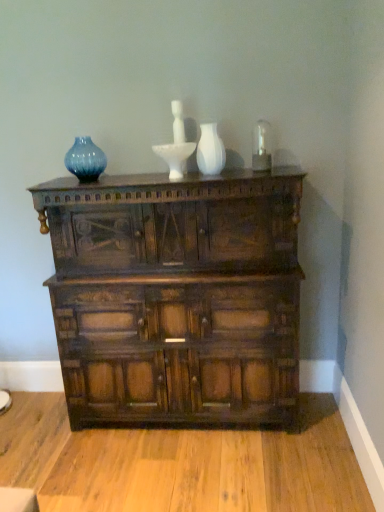
Question: From the image's perspective, is white glossy vase at center on blue glass vase at upper left?

Choices:
 (A) no
 (B) yes

Answer: (A)

Question: Can you confirm if white glossy vase at center is taller than blue glass vase at upper left?

Choices:
 (A) no
 (B) yes

Answer: (B)

Question: Is white glossy vase at center bigger than blue glass vase at upper left?

Choices:
 (A) no
 (B) yes

Answer: (A)

Question: From a real-world perspective, is white glossy vase at center under blue glass vase at upper left?

Choices:
 (A) no
 (B) yes

Answer: (B)

Question: Does white glossy vase at center come in front of blue glass vase at upper left?

Choices:
 (A) yes
 (B) no

Answer: (A)

Question: Do you think blue glass vase at upper left is within dark wood chest of drawers at center, or outside of it?

Choices:
 (A) outside
 (B) inside

Answer: (A)

Question: Looking at the image, does blue glass vase at upper left seem bigger or smaller compared to dark wood chest of drawers at center?

Choices:
 (A) big
 (B) small

Answer: (B)

Question: Would you say blue glass vase at upper left is to the left or to the right of dark wood chest of drawers at center in the picture?

Choices:
 (A) left
 (B) right

Answer: (A)

Question: Considering the positions of point (84, 147) and point (228, 397), is point (84, 147) closer or farther from the camera than point (228, 397)?

Choices:
 (A) closer
 (B) farther

Answer: (B)

Question: Considering the relative positions of dark wood chest of drawers at center and white glossy vase at center in the image provided, is dark wood chest of drawers at center to the left or to the right of white glossy vase at center?

Choices:
 (A) right
 (B) left

Answer: (B)

Question: In terms of width, does dark wood chest of drawers at center look wider or thinner when compared to white glossy vase at center?

Choices:
 (A) thin
 (B) wide

Answer: (B)

Question: From a real-world perspective, is dark wood chest of drawers at center physically located above or below white glossy vase at center?

Choices:
 (A) above
 (B) below

Answer: (B)

Question: Is dark wood chest of drawers at center spatially inside white glossy vase at center, or outside of it?

Choices:
 (A) inside
 (B) outside

Answer: (B)

Question: Looking at their shapes, would you say white glossy vase at center is wider or thinner than dark wood chest of drawers at center?

Choices:
 (A) thin
 (B) wide

Answer: (A)

Question: Which is correct: white glossy vase at center is inside dark wood chest of drawers at center, or outside of it?

Choices:
 (A) inside
 (B) outside

Answer: (B)